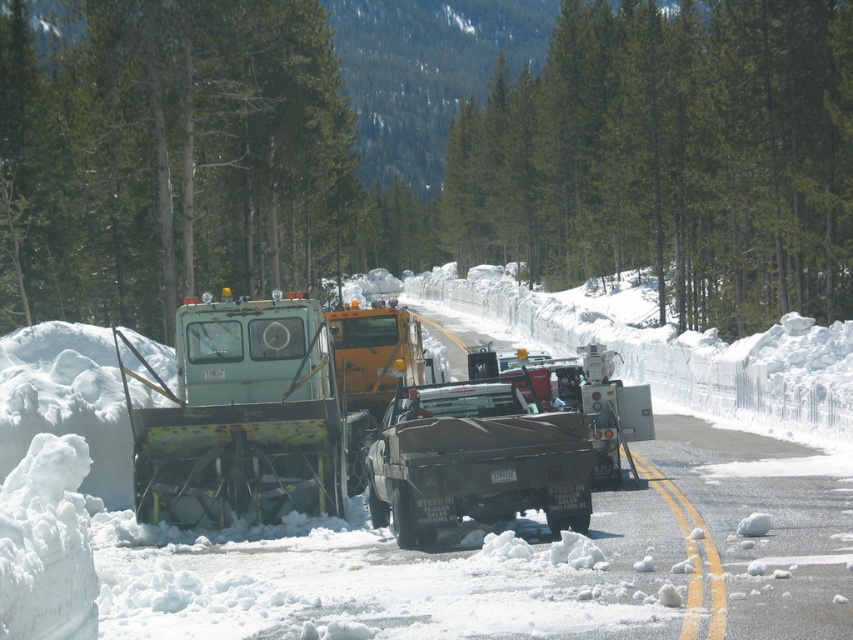
You are a delivery driver who needs to pass through this snowy road. You see a rusty metal snowplow at left and a matte black trailer truck at center. Which vehicle is closer to the left side of the road?

The rusty metal snowplow at left is closer to the left side of the road since it is positioned to the left of the matte black trailer truck at center.

You are a driver approaching the road and see the green matte snowplow at center and the matte black trailer truck at center. Which one is positioned more to the left side of the road?

The green matte snowplow at center is positioned more to the left side of the road than the matte black trailer truck at center.

You are a pedestrian trying to cross the road in this snowy scene. You see the green matte snowplow at center and the rusty metal snowplow at left. Which snowplow is closer to you as you stand on the side of the road?

The green matte snowplow at center is closer to you because it is in front of the rusty metal snowplow at left, meaning it is nearer to your position on the roadside.